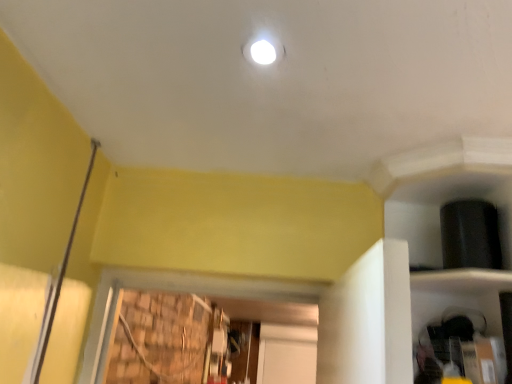
Locate an element on the screen. The image size is (512, 384). white matte door at center is located at coordinates (287, 354).

This screenshot has height=384, width=512. Describe the element at coordinates (287, 354) in the screenshot. I see `white matte door at center` at that location.

The image size is (512, 384). I want to click on white matte door at center, so click(x=287, y=354).